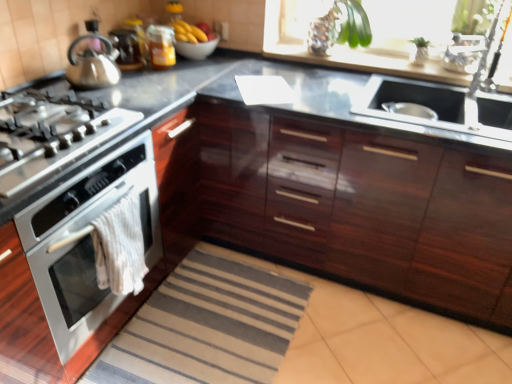
Question: Considering the relative sizes of satin nickel faucet at upper right and yellow matte bananas at upper center in the image provided, is satin nickel faucet at upper right bigger than yellow matte bananas at upper center?

Choices:
 (A) no
 (B) yes

Answer: (B)

Question: From a real-world perspective, does satin nickel faucet at upper right sit lower than yellow matte bananas at upper center?

Choices:
 (A) no
 (B) yes

Answer: (A)

Question: Is satin nickel faucet at upper right positioned in front of yellow matte bananas at upper center?

Choices:
 (A) no
 (B) yes

Answer: (B)

Question: Is satin nickel faucet at upper right thinner than yellow matte bananas at upper center?

Choices:
 (A) yes
 (B) no

Answer: (B)

Question: From the image's perspective, is satin nickel faucet at upper right above yellow matte bananas at upper center?

Choices:
 (A) no
 (B) yes

Answer: (A)

Question: Would you say shiny metallic kettle at upper left is to the left or to the right of metallic silver kettle at upper left in the picture?

Choices:
 (A) left
 (B) right

Answer: (A)

Question: Considering the positions of point (110, 49) and point (128, 64), is point (110, 49) closer or farther from the camera than point (128, 64)?

Choices:
 (A) farther
 (B) closer

Answer: (B)

Question: Is shiny metallic kettle at upper left situated inside metallic silver kettle at upper left or outside?

Choices:
 (A) outside
 (B) inside

Answer: (A)

Question: Considering their positions, is shiny metallic kettle at upper left located in front of or behind metallic silver kettle at upper left?

Choices:
 (A) front
 (B) behind

Answer: (A)

Question: Is white towel at lower left wider or thinner than yellow matte bananas at upper center?

Choices:
 (A) thin
 (B) wide

Answer: (A)

Question: Is point (119, 208) positioned closer to the camera than point (198, 36)?

Choices:
 (A) closer
 (B) farther

Answer: (A)

Question: Visually, is white towel at lower left positioned to the left or to the right of yellow matte bananas at upper center?

Choices:
 (A) right
 (B) left

Answer: (B)

Question: Is white towel at lower left inside the boundaries of yellow matte bananas at upper center, or outside?

Choices:
 (A) outside
 (B) inside

Answer: (A)

Question: From the image's perspective, is satin silver gas stove at left positioned above or below satin steel sink at center right?

Choices:
 (A) below
 (B) above

Answer: (A)

Question: From a real-world perspective, is satin silver gas stove at left physically located above or below satin steel sink at center right?

Choices:
 (A) above
 (B) below

Answer: (A)